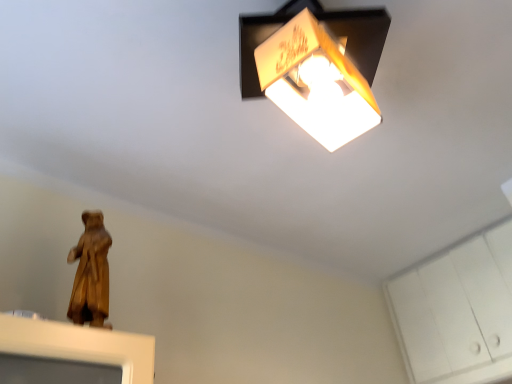
What is the approximate width of wooden statue at lower left?

3.50 inches.

I want to click on wooden statue at lower left, so click(x=91, y=273).

Describe the element at coordinates (91, 273) in the screenshot. I see `wooden statue at lower left` at that location.

This screenshot has width=512, height=384. What do you see at coordinates (458, 312) in the screenshot?
I see `white matte cabinet at lower right` at bounding box center [458, 312].

Identify the location of white matte cabinet at lower right. (458, 312).

Looking at this image, measure the distance between point (451, 347) and camera.

The depth of point (451, 347) is 1.86 meters.

What is the approximate width of white matte cabinet at lower right?

white matte cabinet at lower right is 6.91 centimeters in width.

The height and width of the screenshot is (384, 512). In order to click on wooden statue at lower left in this screenshot , I will do `click(91, 273)`.

Visually, is white matte cabinet at lower right positioned to the left or to the right of wooden statue at lower left?

white matte cabinet at lower right is to the right of wooden statue at lower left.

In the image, is white matte cabinet at lower right positioned in front of or behind wooden statue at lower left?

In the image, white matte cabinet at lower right appears behind wooden statue at lower left.

Which is closer, (492,255) or (89,292)?

Point (492,255) is farther from the camera than point (89,292).

Looking at this image, from the image's perspective, would you say white matte cabinet at lower right is shown under wooden statue at lower left?

Correct, white matte cabinet at lower right appears lower than wooden statue at lower left in the image.

Consider the image. From a real-world perspective, who is located lower, white matte cabinet at lower right or wooden statue at lower left?

In real-world perspective, wooden statue at lower left is lower.

Considering the relative sizes of white matte cabinet at lower right and wooden statue at lower left in the image provided, is white matte cabinet at lower right wider than wooden statue at lower left?

No.

Is white matte cabinet at lower right taller than wooden statue at lower left?

Correct, white matte cabinet at lower right is much taller as wooden statue at lower left.

Which of these two, white matte cabinet at lower right or wooden statue at lower left, is smaller?

With smaller size is wooden statue at lower left.

Can wooden statue at lower left be found inside white matte cabinet at lower right?

That's incorrect, wooden statue at lower left is not inside white matte cabinet at lower right.

Is white matte cabinet at lower right touching wooden statue at lower left?

There is a gap between white matte cabinet at lower right and wooden statue at lower left.

Does white matte cabinet at lower right turn towards wooden statue at lower left?

Yes, white matte cabinet at lower right is turned towards wooden statue at lower left.

You are a GUI agent. You are given a task and a screenshot of the screen. Output one action in this format:
    pyautogui.click(x=<x>, y=<y>)
    Task: Click on the cabinetry that is below the wooden statue at lower left (from the image's perspective)
    The width and height of the screenshot is (512, 384).
    Given the screenshot: What is the action you would take?
    pyautogui.click(x=458, y=312)

Does wooden statue at lower left appear on the left side of white matte cabinet at lower right?

Correct, you'll find wooden statue at lower left to the left of white matte cabinet at lower right.

Which object is further away from the camera taking this photo, wooden statue at lower left or white matte cabinet at lower right?

white matte cabinet at lower right is behind.

Is point (101, 312) closer or farther from the camera than point (413, 352)?

Point (101, 312).

From the image's perspective, which one is positioned higher, wooden statue at lower left or white matte cabinet at lower right?

wooden statue at lower left appears higher in the image.

From a real-world perspective, does wooden statue at lower left stand above white matte cabinet at lower right?

No.

Consider the image. In terms of width, does wooden statue at lower left look wider or thinner when compared to white matte cabinet at lower right?

In the image, wooden statue at lower left appears to be wider than white matte cabinet at lower right.

Considering the sizes of objects wooden statue at lower left and white matte cabinet at lower right in the image provided, who is taller, wooden statue at lower left or white matte cabinet at lower right?

white matte cabinet at lower right is taller.

Which of these two, wooden statue at lower left or white matte cabinet at lower right, is smaller?

wooden statue at lower left is smaller.

Is wooden statue at lower left positioned beyond the bounds of white matte cabinet at lower right?

wooden statue at lower left lies outside white matte cabinet at lower right's area.

From the picture: Is there a large distance between wooden statue at lower left and white matte cabinet at lower right?

Indeed, wooden statue at lower left is not near white matte cabinet at lower right.

Is wooden statue at lower left turned away from white matte cabinet at lower right?

wooden statue at lower left does not have its back to white matte cabinet at lower right.

How much distance is there between wooden statue at lower left and white matte cabinet at lower right?

4.98 feet.

This screenshot has height=384, width=512. I want to click on cabinetry below the wooden statue at lower left (from the image's perspective), so click(458, 312).

Find the location of a particular element. cabinetry above the wooden statue at lower left (from a real-world perspective) is located at coordinates (458, 312).

This screenshot has height=384, width=512. I want to click on person in front of the white matte cabinet at lower right, so click(x=91, y=273).